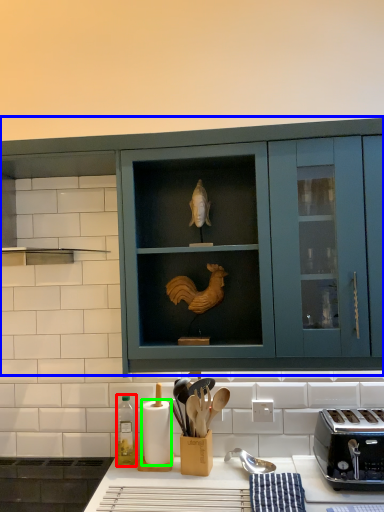
Question: Which object is the farthest from bottle (highlighted by a red box)? Choose among these: cabinetry (highlighted by a blue box) or paper towel (highlighted by a green box).

Choices:
 (A) cabinetry
 (B) paper towel

Answer: (A)